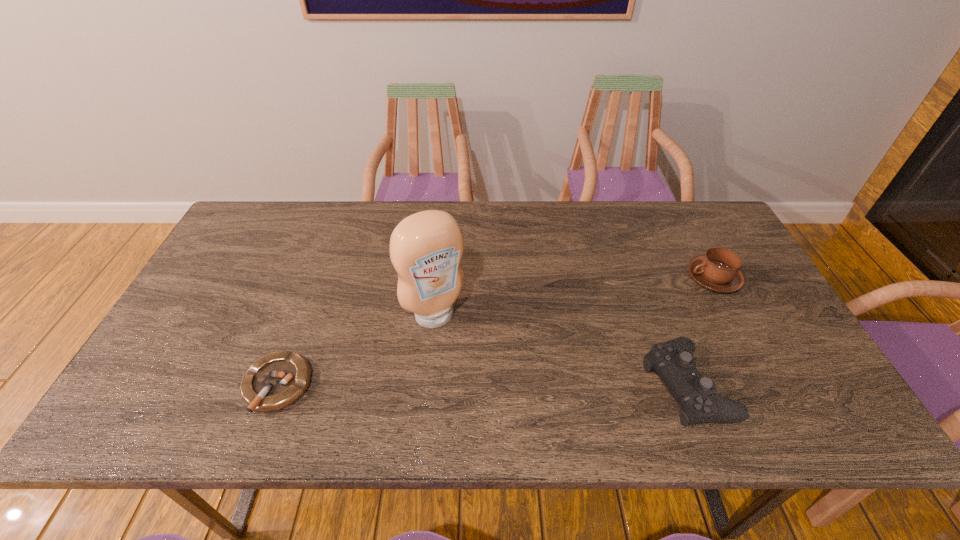
The image size is (960, 540). I want to click on empty location between the condiment and the cappuccino, so click(x=574, y=297).

Find the location of a particular element. This screenshot has height=540, width=960. object that is the third closest to the tallest object is located at coordinates (x=719, y=270).

Locate an element on the screen. This screenshot has width=960, height=540. object that is the closest to the leftmost object is located at coordinates (426, 248).

Where is `free space that satisfies the following two spatial constraints: 1. on the back side of the rightmost object; 2. on the right side of the ashtray`? This screenshot has width=960, height=540. free space that satisfies the following two spatial constraints: 1. on the back side of the rightmost object; 2. on the right side of the ashtray is located at coordinates (317, 278).

I want to click on free space that satisfies the following two spatial constraints: 1. on the back side of the cappuccino; 2. on the left side of the shortest object, so click(x=317, y=278).

The image size is (960, 540). Find the location of `vacant space that satisfies the following two spatial constraints: 1. on the back side of the cappuccino; 2. on the left side of the control`. vacant space that satisfies the following two spatial constraints: 1. on the back side of the cappuccino; 2. on the left side of the control is located at coordinates (647, 278).

You are a GUI agent. You are given a task and a screenshot of the screen. Output one action in this format:
    pyautogui.click(x=<x>, y=<y>)
    Task: Click on the vacant region that satisfies the following two spatial constraints: 1. on the back side of the cappuccino; 2. on the left side of the third object from left to right
    The width and height of the screenshot is (960, 540).
    Given the screenshot: What is the action you would take?
    pyautogui.click(x=647, y=278)